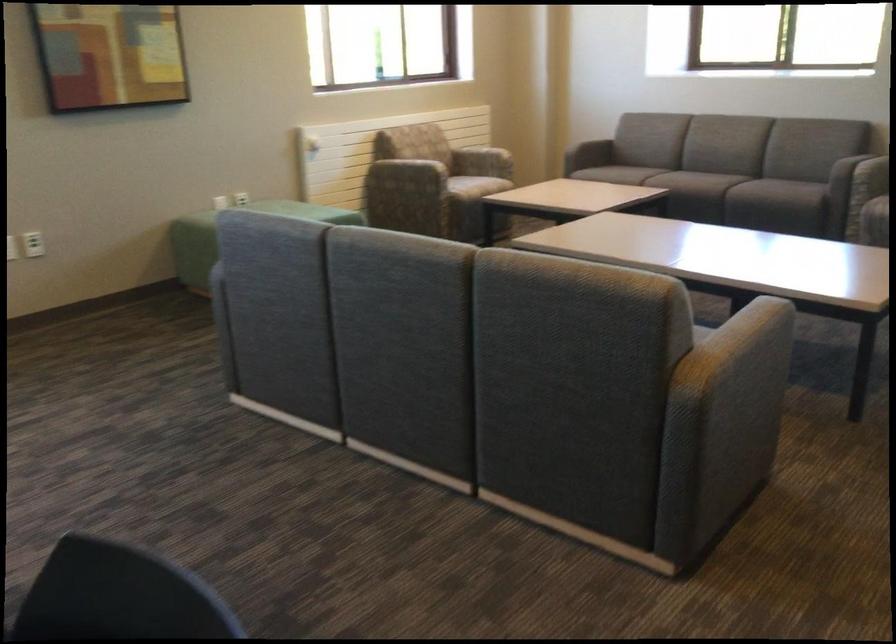
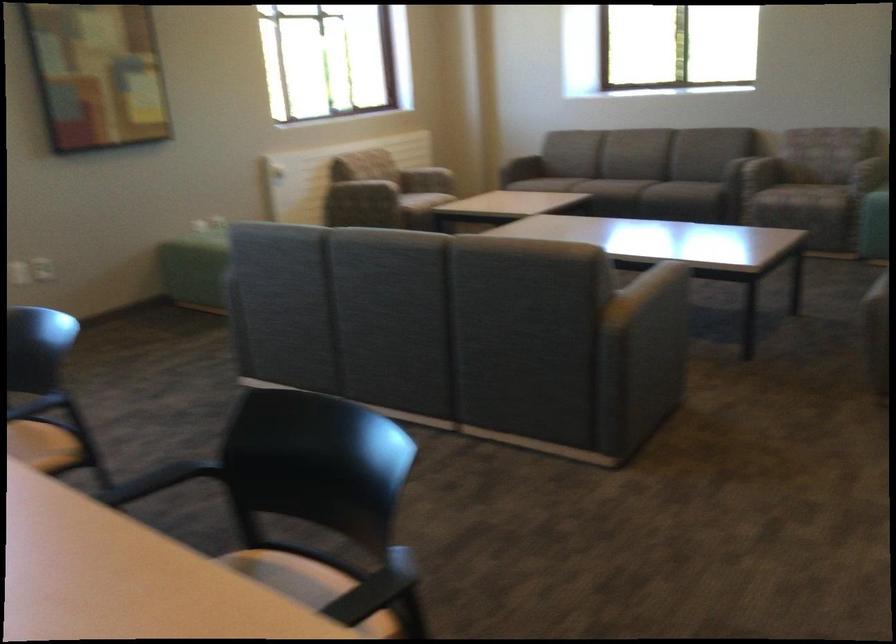
Question: I am providing you with two images of the same scene from different viewpoints. Please identify which objects are invisible in image2.

Choices:
 (A) chair armrest
 (B) chair sitting surface
 (C) sofa armrest
 (D) none of these

Answer: (D)